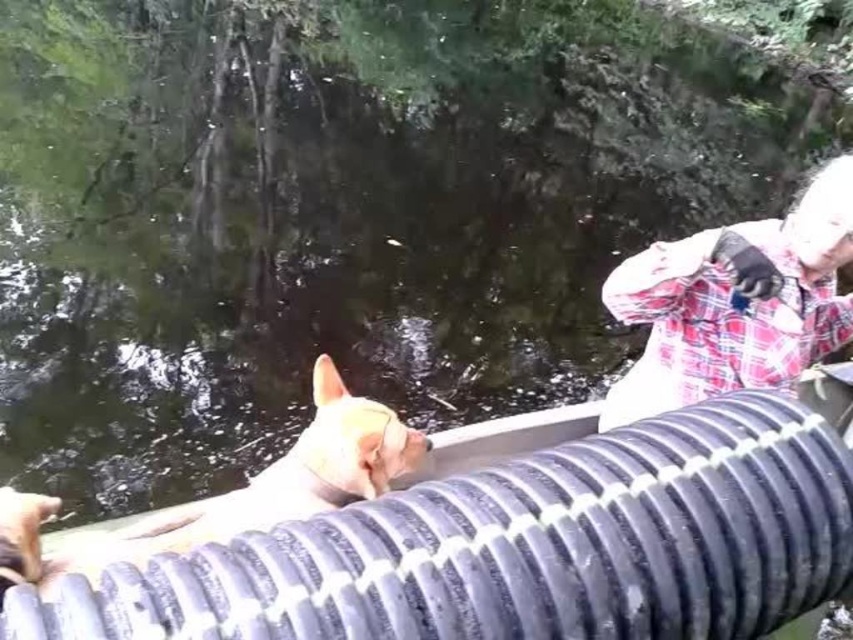
You are a photographer trying to capture a shot of the light brown fur cat at center and the white plaid shirt at upper right. Which object is closer to the camera?

The light brown fur cat at center is behind the white plaid shirt at upper right, so the white plaid shirt at upper right is closer to the camera.

You are a photographer trying to capture the black rubber hose at center and the white plaid shirt at upper right in the same frame. Based on their positions, which object would appear closer to the camera in the photo?

The black rubber hose at center appears closer to the camera than the white plaid shirt at upper right because it is positioned in front of it.